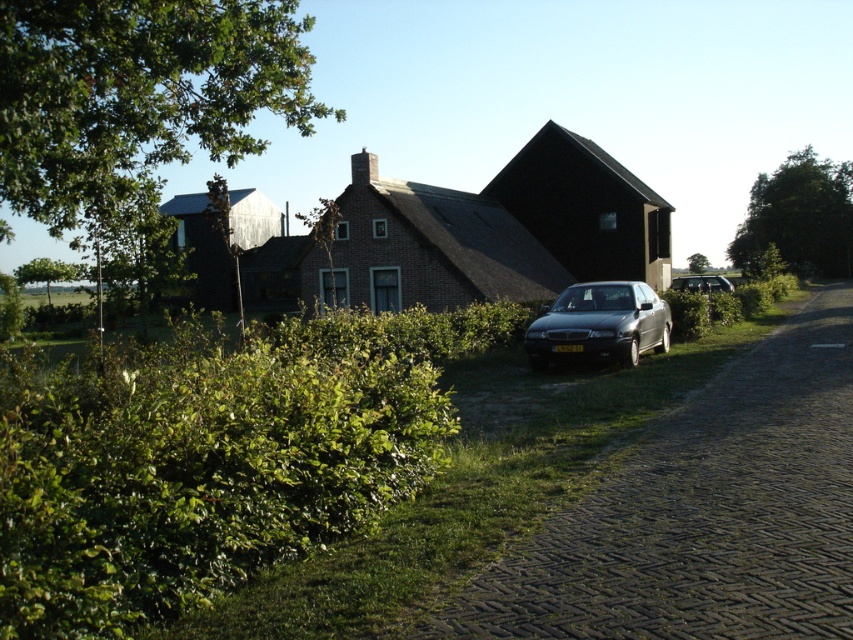
You are standing in front of the house and want to take a photo. There are two points marked in the scene, point 1 at coordinates point (x=654, y=541) and point 2 at coordinates point (x=688, y=280). Which point is closer to you?

Point (x=654, y=541) is closer to the camera than point (x=688, y=280).